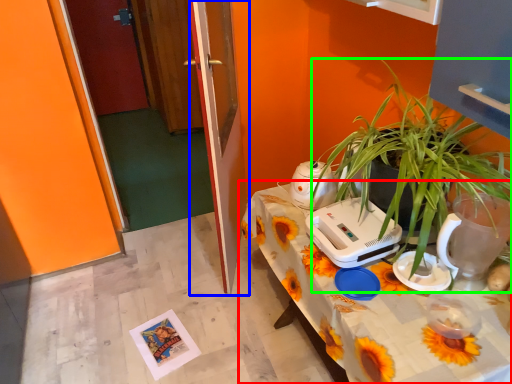
Question: Based on their relative distances, which object is nearer to table (highlighted by a red box)? Choose from glass door (highlighted by a blue box) and houseplant (highlighted by a green box).

Choices:
 (A) glass door
 (B) houseplant

Answer: (B)